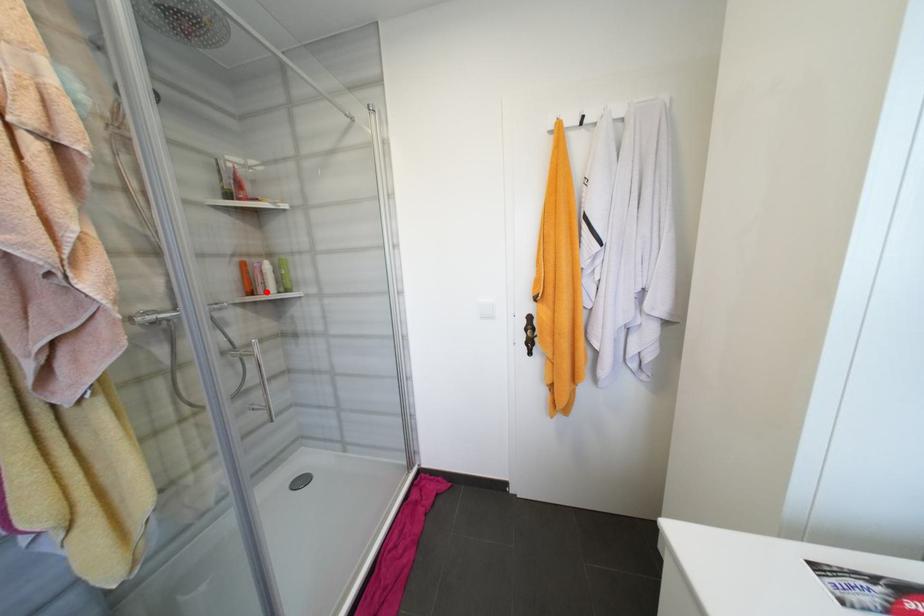
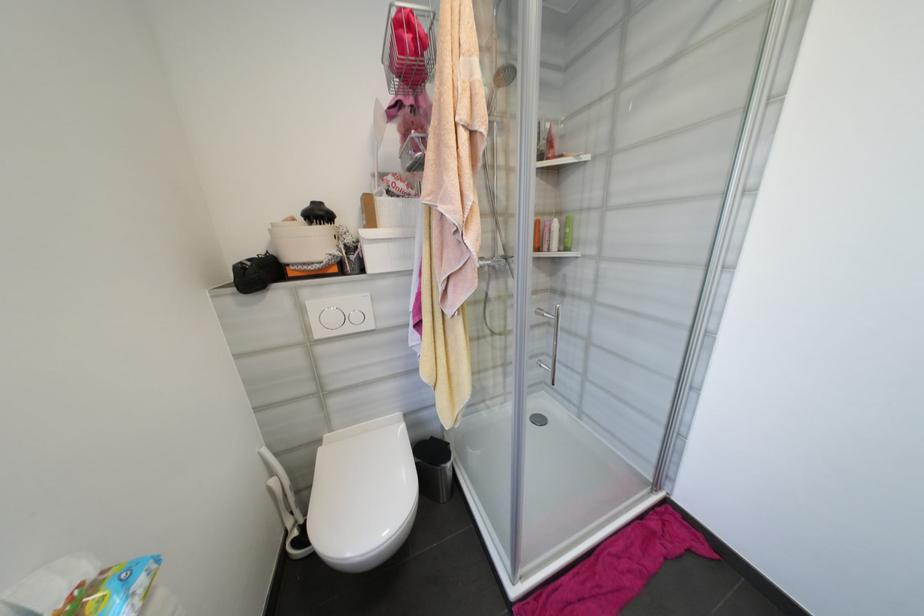
Locate, in the second image, the point that corresponds to the highlighted location in the first image.

(551, 249)